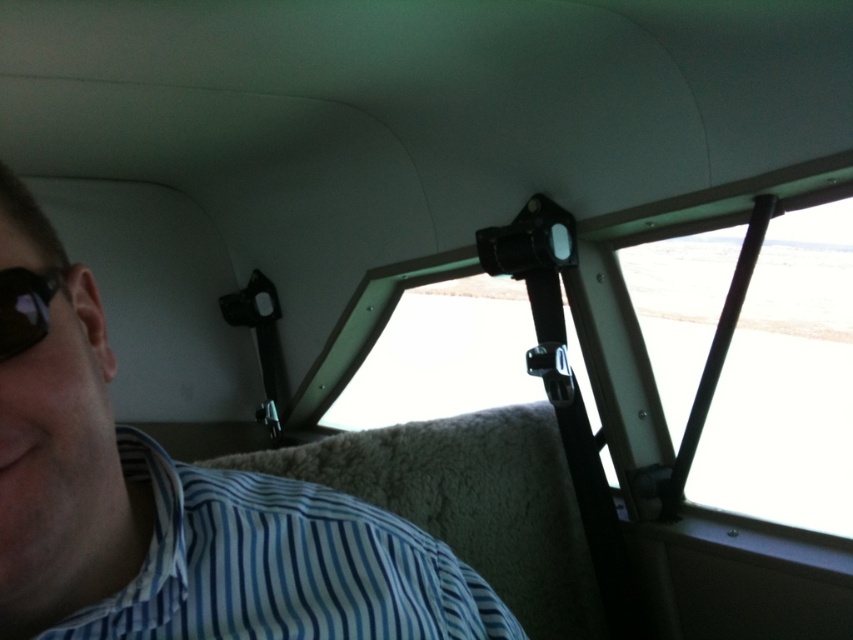
You are inside the aircraft cabin and want to check the outside view through the transparent plastic window at upper center while also looking at the blue striped fabric shirt at lower left. Which object is wider?

The transparent plastic window at upper center is wider than the blue striped fabric shirt at lower left.

You are inside the cabin of a small aircraft. You notice the transparent plastic window at upper center and the blue striped fabric shirt at lower left. Which object is positioned higher in the cabin?

The transparent plastic window at upper center is positioned higher than the blue striped fabric shirt at lower left.